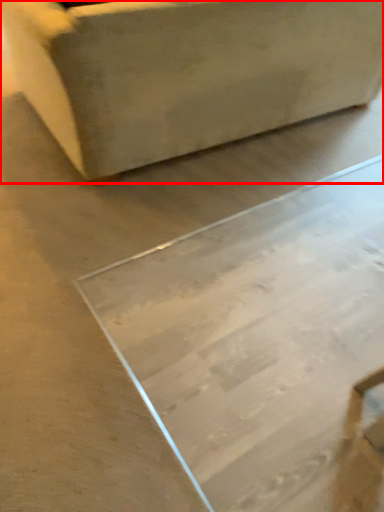
Question: From the image's perspective, where is furniture (annotated by the red box) located relative to table?

Choices:
 (A) below
 (B) above

Answer: (B)